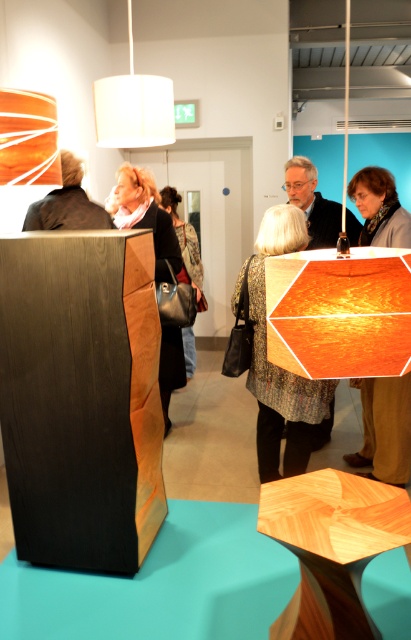
Can you confirm if matte orange hexagonal lampshade at center is positioned below matte black jacket at upper left?

Yes.

Image resolution: width=411 pixels, height=640 pixels. Identify the location of matte orange hexagonal lampshade at center. (385, 428).

Does matte brown coat at center have a larger size compared to matte black jacket at upper left?

Indeed, matte brown coat at center has a larger size compared to matte black jacket at upper left.

Which is more to the right, matte brown coat at center or matte black jacket at upper left?

From the viewer's perspective, matte brown coat at center appears more on the right side.

The image size is (411, 640). I want to click on matte brown coat at center, so click(147, 216).

Does white fabric lampshade at upper center come behind matte brown coat at center?

No, it is not.

Who is shorter, white fabric lampshade at upper center or matte brown coat at center?

white fabric lampshade at upper center

Is point (108, 122) less distant than point (173, 260)?

Yes, point (108, 122) is in front of point (173, 260).

Find the location of a particular element. This screenshot has height=640, width=411. white fabric lampshade at upper center is located at coordinates (133, 106).